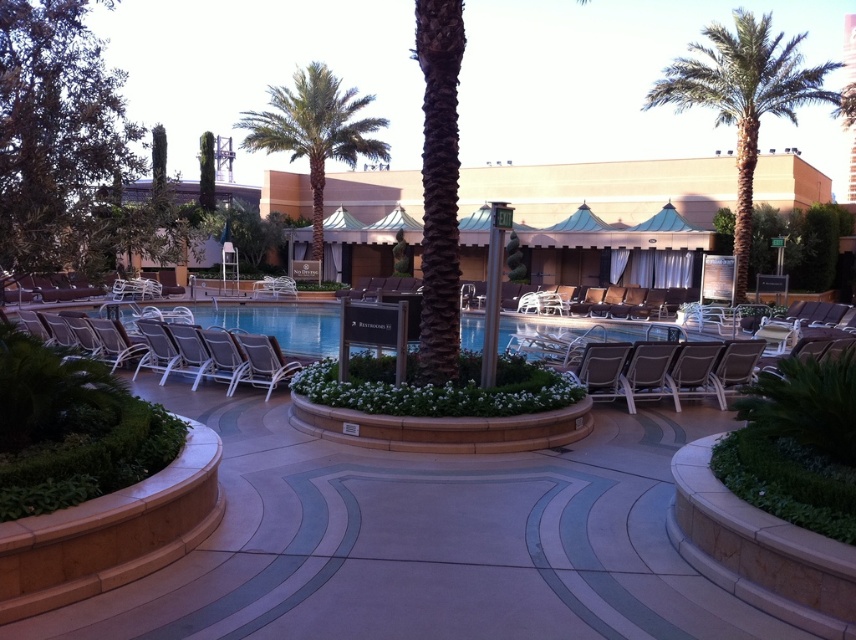
Which is more to the left, beige concrete resort at center or green leafy palm tree at upper center?

Positioned to the left is green leafy palm tree at upper center.

Is beige concrete resort at center positioned at the back of green leafy palm tree at upper center?

No, beige concrete resort at center is in front of green leafy palm tree at upper center.

This screenshot has width=856, height=640. What are the coordinates of `beige concrete resort at center` in the screenshot? It's located at (593, 211).

Can you confirm if green leafy palm tree at upper right is smaller than metallic silver lounge chair at center?

Incorrect, green leafy palm tree at upper right is not smaller in size than metallic silver lounge chair at center.

Is green leafy palm tree at upper right shorter than metallic silver lounge chair at center?

Incorrect, green leafy palm tree at upper right's height does not fall short of metallic silver lounge chair at center's.

Is point (753, 128) closer to camera compared to point (270, 358)?

No.

This screenshot has height=640, width=856. Find the location of `green leafy palm tree at upper right`. green leafy palm tree at upper right is located at coordinates click(742, 97).

Is white mesh chair at left to the right of gray fabric beach chair at center from the viewer's perspective?

No, white mesh chair at left is not to the right of gray fabric beach chair at center.

The height and width of the screenshot is (640, 856). What do you see at coordinates (235, 348) in the screenshot?
I see `white mesh chair at left` at bounding box center [235, 348].

Is point (263, 358) closer to camera compared to point (642, 384)?

No, (263, 358) is further to viewer.

Where is `white mesh chair at left`? white mesh chair at left is located at coordinates (235, 348).